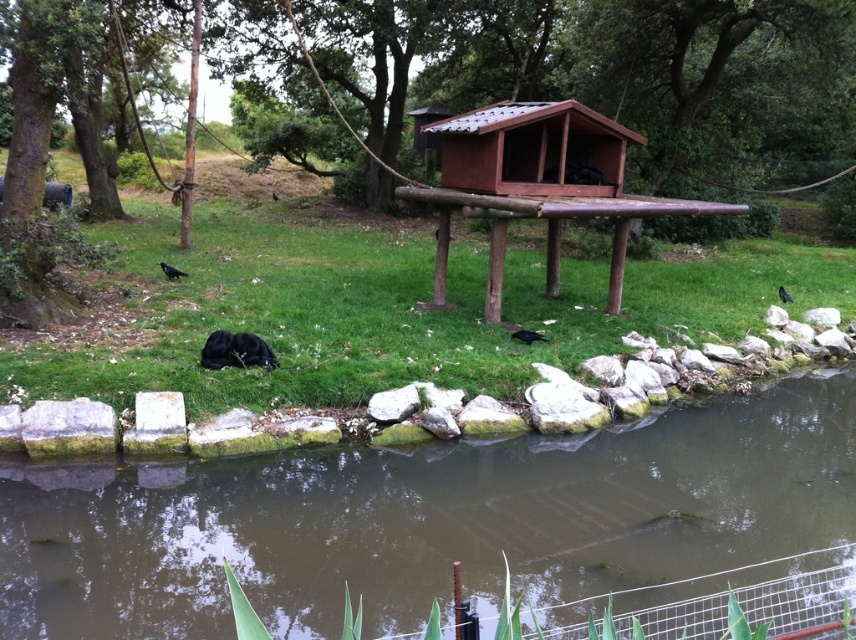
Is brown wooden hut at center below black matte bird at lower left?

No.

Is the position of brown wooden hut at center less distant than that of black matte bird at lower left?

Yes, brown wooden hut at center is closer to the viewer.

Between point (509, 145) and point (167, 276), which one is positioned in front?

Positioned in front is point (509, 145).

At what (x,y) coordinates should I click in order to perform the action: click on brown wooden hut at center. Please return your answer as a coordinate pair (x, y). Looking at the image, I should click on (532, 148).

Who is more forward, (581, 115) or (538, 336)?

Point (538, 336) is more forward.

Is brown wooden hut at center shorter than black matte bird at lower center?

Incorrect, brown wooden hut at center's height does not fall short of black matte bird at lower center's.

Is point (497, 170) farther from camera compared to point (531, 339)?

Yes, point (497, 170) is behind point (531, 339).

Where is `brown wooden hut at center`? brown wooden hut at center is located at coordinates (532, 148).

Does point (616, 344) come closer to viewer compared to point (596, 182)?

Yes, point (616, 344) is closer to viewer.

This screenshot has width=856, height=640. What do you see at coordinates (391, 312) in the screenshot? I see `green grass at center` at bounding box center [391, 312].

The width and height of the screenshot is (856, 640). What do you see at coordinates (391, 312) in the screenshot? I see `green grass at center` at bounding box center [391, 312].

Find the location of a particular element. green grass at center is located at coordinates (391, 312).